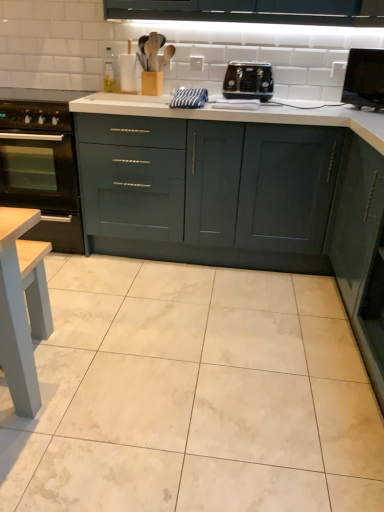
What do you see at coordinates (209, 190) in the screenshot? I see `teal matte cabinet at center, which is the first cabinetry in back-to-front order` at bounding box center [209, 190].

What is the approximate width of teal matte cabinet at center, the 1th cabinetry positioned from the left?

teal matte cabinet at center, the 1th cabinetry positioned from the left, is 25.20 inches wide.

This screenshot has width=384, height=512. In order to click on black plastic toaster at upper center in this screenshot , I will do `click(248, 81)`.

You are a GUI agent. You are given a task and a screenshot of the screen. Output one action in this format:
    pyautogui.click(x=<x>, y=<y>)
    Task: Click on the black glossy monitor at upper right
    
    Given the screenshot: What is the action you would take?
    pyautogui.click(x=364, y=79)

This screenshot has width=384, height=512. Identify the location of matte dark green cabinet at right, which is counted as the 2th cabinetry, starting from the back. (360, 250).

Considering the relative positions of black glass oven at lower left and black glossy monitor at upper right in the image provided, is black glass oven at lower left in front of black glossy monitor at upper right?

No, the depth of black glass oven at lower left is greater than that of black glossy monitor at upper right.

In the image, there is a black glossy monitor at upper right. Where is `oven below it (from the image's perspective)`? Image resolution: width=384 pixels, height=512 pixels. oven below it (from the image's perspective) is located at coordinates (41, 170).

Which of these two, black glass oven at lower left or black glossy monitor at upper right, is bigger?

Bigger between the two is black glass oven at lower left.

Which is in front, point (13, 150) or point (357, 73)?

Point (13, 150)

Which of these two, black matte gas stove at left or white glossy tile at center, stands taller?

black matte gas stove at left.

Consider the image. Measure the distance from black matte gas stove at left to white glossy tile at center.

The distance of black matte gas stove at left from white glossy tile at center is 4.80 feet.

Which of these two, black matte gas stove at left or white glossy tile at center, is bigger?

Bigger between the two is white glossy tile at center.

From a real-world perspective, which is physically below, black matte gas stove at left or white glossy tile at center?

white glossy tile at center.

Can you confirm if black plastic toaster at upper center is positioned to the left of black matte gas stove at left?

No.

Is black matte gas stove at left at the back of black plastic toaster at upper center?

No.

Looking at this image, is there a large distance between black plastic toaster at upper center and black matte gas stove at left?

Yes, black plastic toaster at upper center and black matte gas stove at left are quite far apart.

Looking at this image, which is more distant, (246,75) or (2,106)?

The point (246,75) is farther.

Could you tell me if black plastic toaster at upper center is facing white glossy tile at center?

No.

In the scene shown: Which point is more forward, [256,98] or [248,296]?

Positioned in front is point [248,296].

In the scene shown: Is black plastic toaster at upper center completely or partially outside of white glossy tile at center?

Yes.

Can you tell me how much black matte gas stove at left and black glossy monitor at upper right differ in facing direction?

They differ by 41.8 degrees in their facing directions.

Can you confirm if black matte gas stove at left is positioned to the right of black glossy monitor at upper right?

Incorrect, black matte gas stove at left is not on the right side of black glossy monitor at upper right.

Which object is thinner, black matte gas stove at left or black glossy monitor at upper right?

black glossy monitor at upper right.

In the scene shown: Is black matte gas stove at left closer to camera compared to black glossy monitor at upper right?

That is False.

Is the position of teal matte cabinet at center, the 1th cabinetry positioned from the left, more distant than that of white glossy tile at center?

Yes, teal matte cabinet at center, the 1th cabinetry positioned from the left, is behind white glossy tile at center.

Is teal matte cabinet at center, which is counted as the second cabinetry, starting from the right, facing away from white glossy tile at center?

No.

Is teal matte cabinet at center, which is counted as the second cabinetry, starting from the right, next to white glossy tile at center?

No, teal matte cabinet at center, which is counted as the second cabinetry, starting from the right, is not next to white glossy tile at center.

Does teal matte cabinet at center, the 1th cabinetry positioned from the left, have a larger size compared to white glossy tile at center?

Correct, teal matte cabinet at center, the 1th cabinetry positioned from the left, is larger in size than white glossy tile at center.

Who is smaller, teal matte cabinet at center, arranged as the second cabinetry when viewed from the front, or black glossy monitor at upper right?

black glossy monitor at upper right.

From the picture: From the image's perspective, would you say teal matte cabinet at center, arranged as the second cabinetry when viewed from the front, is shown under black glossy monitor at upper right?

Yes, from the image's perspective, teal matte cabinet at center, arranged as the second cabinetry when viewed from the front, is below black glossy monitor at upper right.

Is teal matte cabinet at center, the 1th cabinetry positioned from the left, not near black glossy monitor at upper right?

No, teal matte cabinet at center, the 1th cabinetry positioned from the left, is not far away from black glossy monitor at upper right.

The height and width of the screenshot is (512, 384). I want to click on oven below the black glossy monitor at upper right (from a real-world perspective), so click(41, 170).

The image size is (384, 512). In order to click on gas stove on the left of the white glossy tile at center in this screenshot , I will do `click(37, 108)`.

Based on their spatial positions, is matte dark green cabinet at right, marked as the first cabinetry in a front-to-back arrangement, or black glass oven at lower left further from black glossy monitor at upper right?

black glass oven at lower left is positioned further to the anchor black glossy monitor at upper right.

Which object lies nearer to the anchor point teal matte cabinet at center, arranged as the second cabinetry when viewed from the front, black matte gas stove at left or black glass oven at lower left?

black glass oven at lower left.

Estimate the real-world distances between objects in this image. Which object is further from black matte gas stove at left, black plastic toaster at upper center or matte dark green cabinet at right, the second cabinetry in the left-to-right sequence?

matte dark green cabinet at right, the second cabinetry in the left-to-right sequence, is positioned further to the anchor black matte gas stove at left.

When comparing their distances from black glass oven at lower left, does matte dark green cabinet at right, marked as the first cabinetry in a front-to-back arrangement, or black matte gas stove at left seem further?

matte dark green cabinet at right, marked as the first cabinetry in a front-to-back arrangement, is further to black glass oven at lower left.

Considering their positions, is white glossy tile at center positioned closer to black plastic toaster at upper center than black glass oven at lower left?

black glass oven at lower left.

Based on their spatial positions, is teal matte cabinet at center, which is the first cabinetry in back-to-front order, or black glass oven at lower left closer to matte dark green cabinet at right, placed as the first cabinetry when sorted from right to left?

teal matte cabinet at center, which is the first cabinetry in back-to-front order, is closer to matte dark green cabinet at right, placed as the first cabinetry when sorted from right to left.

Considering their positions, is black matte gas stove at left positioned closer to teal matte cabinet at center, which is the first cabinetry in back-to-front order, than black plastic toaster at upper center?

black plastic toaster at upper center lies closer to teal matte cabinet at center, which is the first cabinetry in back-to-front order, than the other object.

When comparing their distances from teal matte cabinet at center, the 1th cabinetry positioned from the left, does black glossy monitor at upper right or black plastic toaster at upper center seem further?

black glossy monitor at upper right is further to teal matte cabinet at center, the 1th cabinetry positioned from the left.

I want to click on cabinetry located between matte dark green cabinet at right, the second cabinetry in the left-to-right sequence, and black plastic toaster at upper center in the depth direction, so click(209, 190).

This screenshot has height=512, width=384. I want to click on oven between black matte gas stove at left and white glossy tile at center in the up-down direction, so click(x=41, y=170).

Locate an element on the screen. cabinetry between black glossy monitor at upper right and matte dark green cabinet at right, placed as the first cabinetry when sorted from right to left, in the up-down direction is located at coordinates (209, 190).

Locate an element on the screen. The height and width of the screenshot is (512, 384). ceramic tile between black glass oven at lower left and black plastic toaster at upper center is located at coordinates (193, 395).